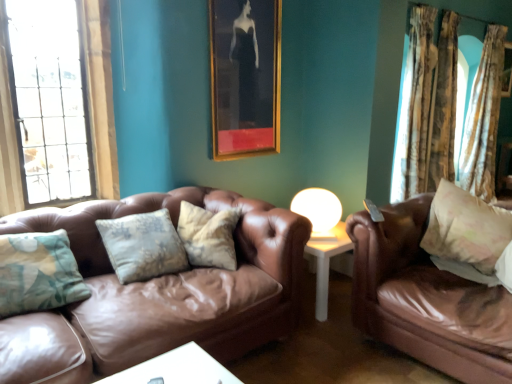
Question: From a real-world perspective, is white glossy table lamp at center positioned above or below fluffy beige pillow at right?

Choices:
 (A) below
 (B) above

Answer: (A)

Question: Does point (311, 225) appear closer or farther from the camera than point (479, 198)?

Choices:
 (A) closer
 (B) farther

Answer: (B)

Question: Which is farther from the textured beige curtain at right, which appears as the third curtain when viewed from the right?

Choices:
 (A) wooden picture frame at upper right, which is counted as the 1th picture frame, starting from the right
 (B) brown leather couch at right, the 2th studio couch in the left-to-right sequence
 (C) textured beige curtain at right, which is the 3th curtain in left-to-right order
 (D) clear glass window at left
 (E) floral fabric curtain at right, which ranks as the 2th curtain in left-to-right order

Answer: (D)

Question: Estimate the real-world distances between objects in this image. Which object is closer to the wooden picture frame at upper right, the second picture frame from the left?

Choices:
 (A) textured beige curtain at right, acting as the 1th curtain starting from the right
 (B) textured beige curtain at right, which appears as the third curtain when viewed from the right
 (C) fluffy beige pillow at right
 (D) brown leather couch at right, the 2th studio couch in the left-to-right sequence
 (E) white glossy table lamp at center

Answer: (A)